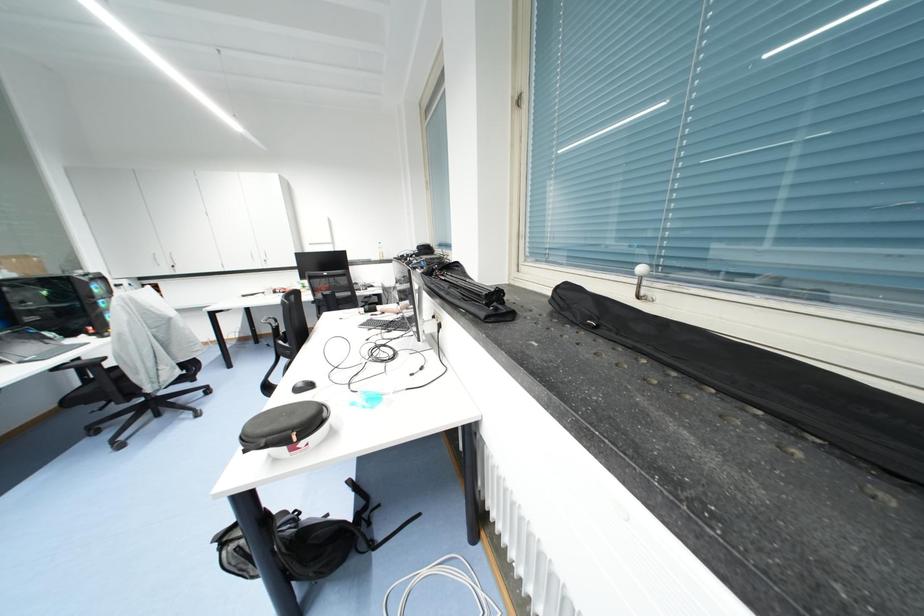
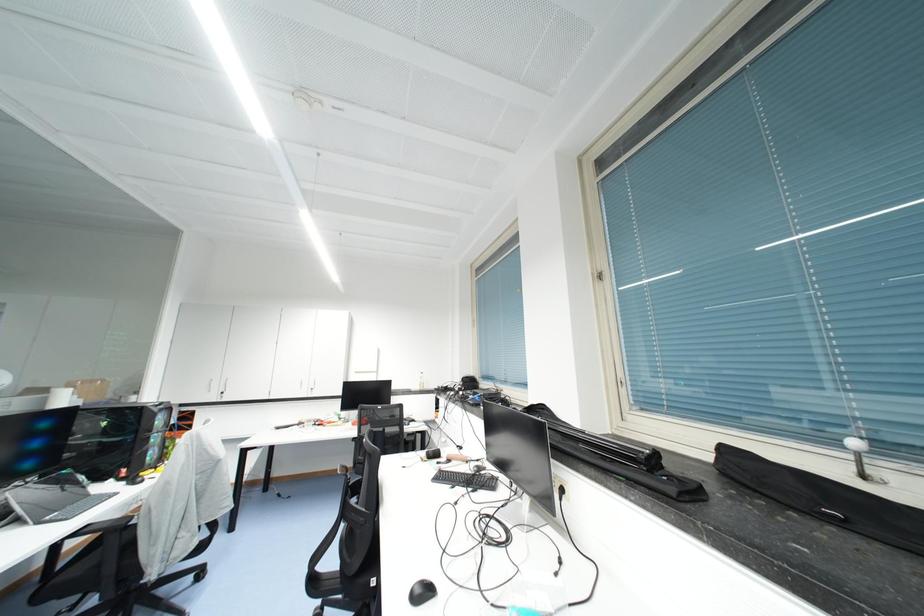
Question: Which direction would the cameraman need to move to produce the second image? Reply with the corresponding letter.

Choices:
 (A) Left
 (B) Right
 (C) Forward
 (D) Backward

Answer: (A)